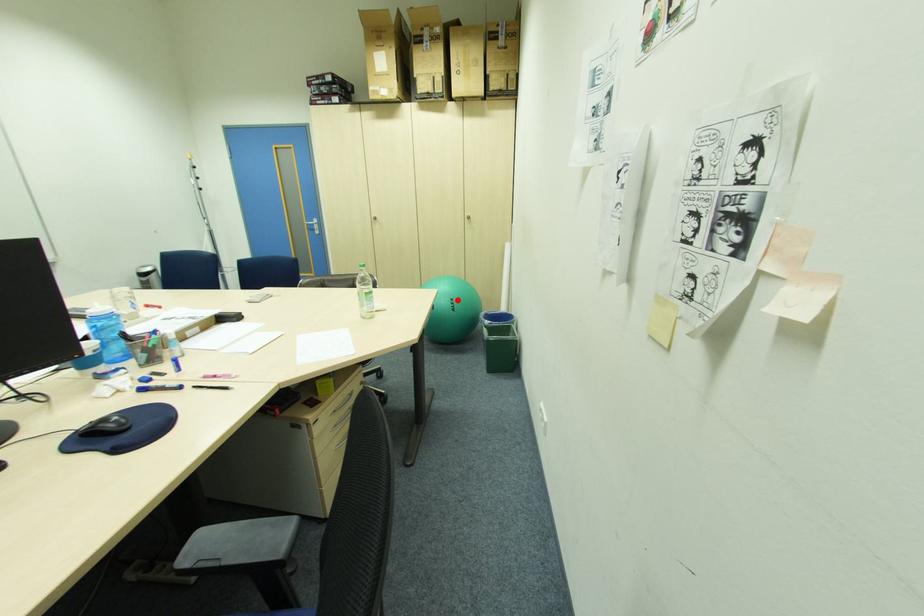
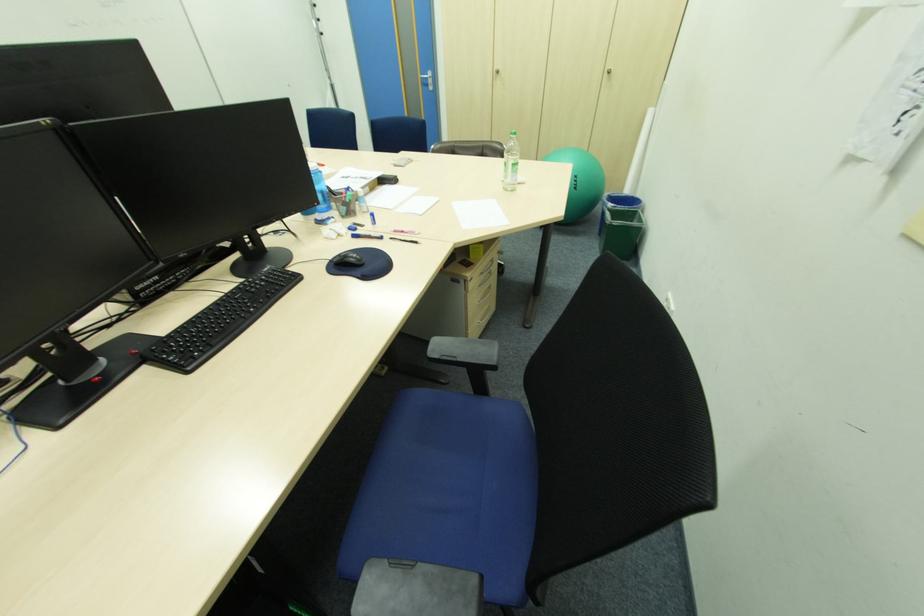
The point at the highlighted location is marked in the first image. Where is the corresponding point in the second image?

(581, 177)